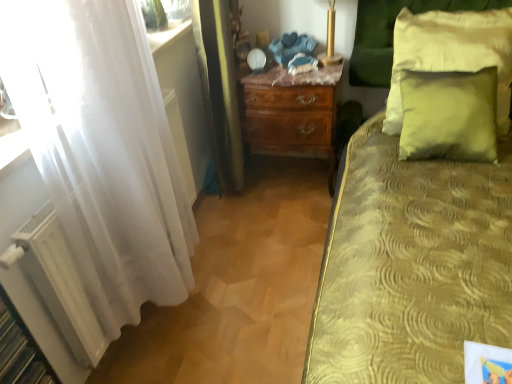
Question: In the image, is white matte radiator at lower left on the left side or the right side of mahogany wood nightstand at center?

Choices:
 (A) left
 (B) right

Answer: (A)

Question: Considering the positions of white matte radiator at lower left and mahogany wood nightstand at center in the image, is white matte radiator at lower left bigger or smaller than mahogany wood nightstand at center?

Choices:
 (A) small
 (B) big

Answer: (A)

Question: Which is farther from the green velvet pillow at upper right, which appears as the first pillow when ordered from the bottom?

Choices:
 (A) white matte radiator at lower left
 (B) white sheer curtain at left
 (C) mahogany wood nightstand at center
 (D) green velvet pillow at upper right, which is counted as the second pillow, starting from the bottom

Answer: (A)

Question: Estimate the real-world distances between objects in this image. Which object is farther from the mahogany wood nightstand at center?

Choices:
 (A) green velvet pillow at upper right, the first pillow positioned from the top
 (B) white matte radiator at lower left
 (C) white sheer curtain at left
 (D) green velvet pillow at upper right, which appears as the first pillow when ordered from the bottom

Answer: (B)